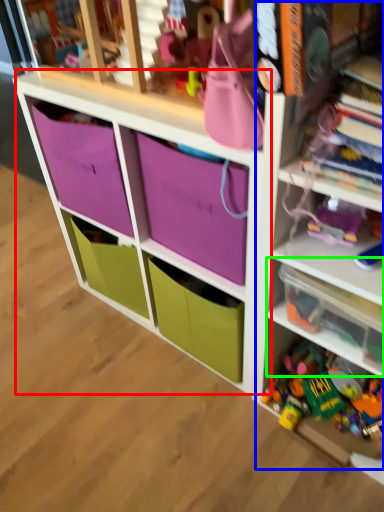
Question: Which is farther away from cabinet (highlighted by a red box)? bookshelf (highlighted by a blue box) or shelf (highlighted by a green box)?

Choices:
 (A) bookshelf
 (B) shelf

Answer: (B)